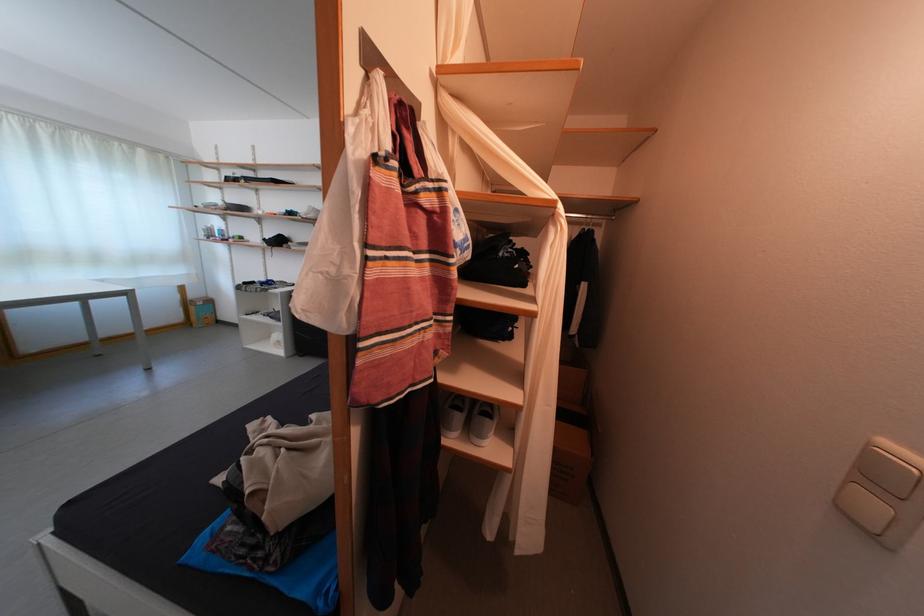
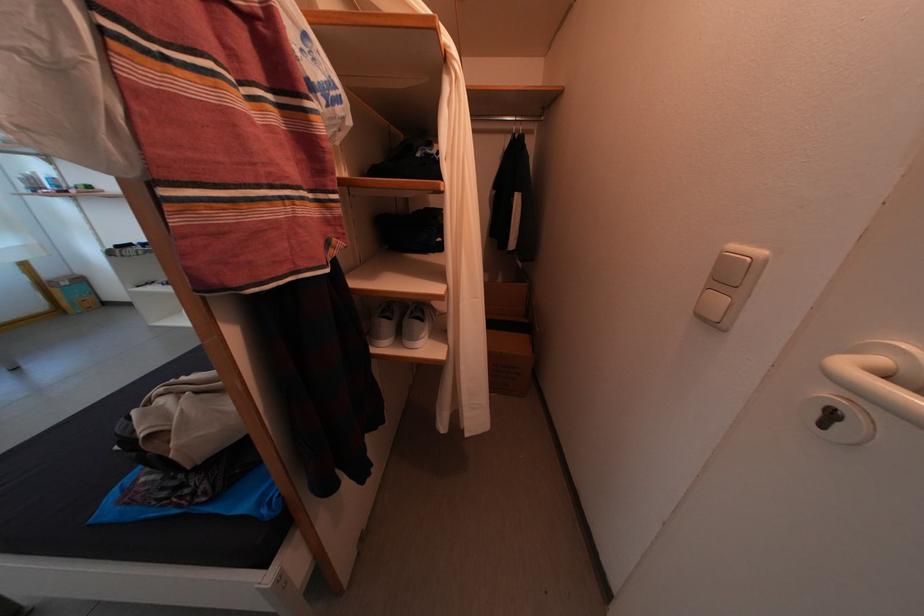
The point at (469, 416) is marked in the first image. Where is the corresponding point in the second image?

(398, 323)